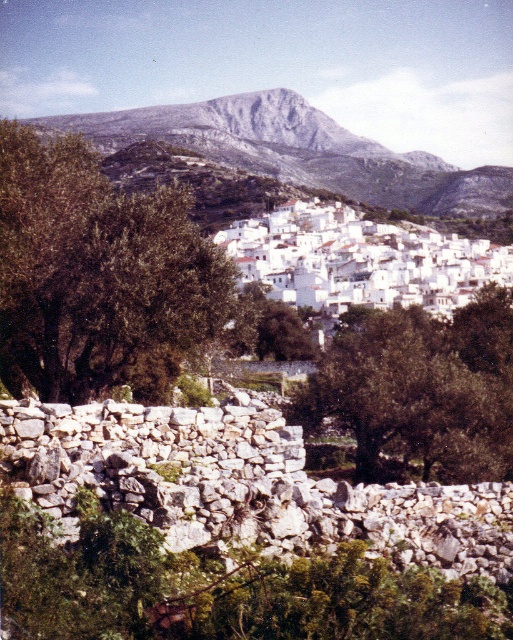
Question: Estimate the real-world distances between objects in this image. Which object is farther from the green leafy tree at left?

Choices:
 (A) white stone houses at center
 (B) green leafy tree at center
 (C) rugged stone mountain at upper center

Answer: (C)

Question: Can you confirm if green leafy tree at left is positioned to the right of white stone houses at center?

Choices:
 (A) no
 (B) yes

Answer: (A)

Question: Does green leafy tree at center lie behind rugged stone mountain at upper center?

Choices:
 (A) no
 (B) yes

Answer: (A)

Question: Can you confirm if green leafy tree at left is wider than green leafy tree at center?

Choices:
 (A) no
 (B) yes

Answer: (B)

Question: Considering the real-world distances, which object is closest to the rugged stone mountain at upper center?

Choices:
 (A) white stone houses at center
 (B) green leafy tree at center

Answer: (A)

Question: Which of these objects is positioned closest to the rugged stone mountain at upper center?

Choices:
 (A) green leafy tree at left
 (B) green leafy tree at center
 (C) white stone houses at center

Answer: (C)